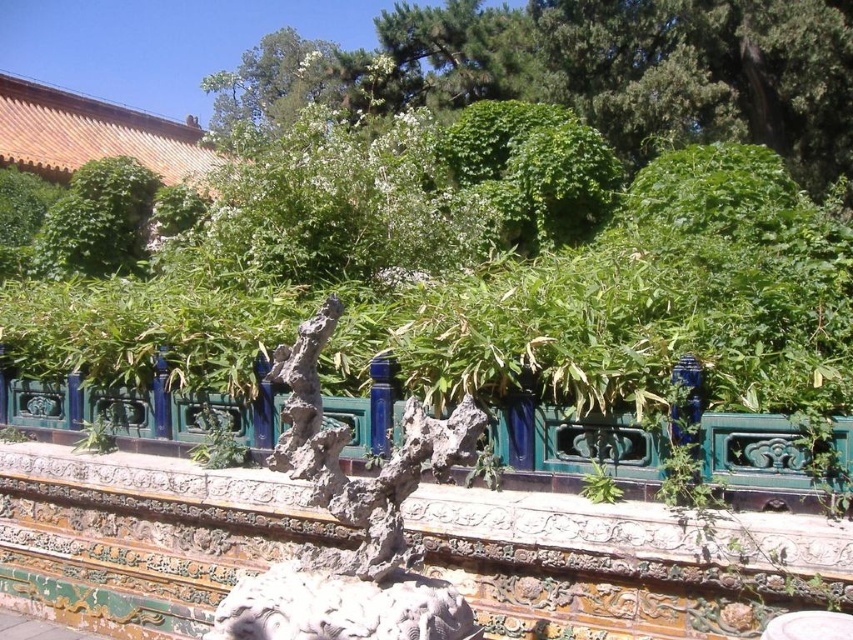
Image resolution: width=853 pixels, height=640 pixels. Identify the location of green leafy bush at upper center. (595, 72).

Which is behind, point (720, 132) or point (850, 429)?

Positioned behind is point (720, 132).

Image resolution: width=853 pixels, height=640 pixels. Find the location of `green leafy bush at upper center`. green leafy bush at upper center is located at coordinates (595, 72).

Is green leafy bush at upper left closer to camera compared to green leafy tree at upper center?

No, it is behind green leafy tree at upper center.

Based on the photo, does green leafy bush at upper left appear on the left side of green leafy tree at upper center?

Indeed, green leafy bush at upper left is positioned on the left side of green leafy tree at upper center.

I want to click on green leafy bush at upper left, so click(x=97, y=220).

Can you confirm if orange glazed tile roof at upper left is smaller than green leafy bush at upper left?

Actually, orange glazed tile roof at upper left might be larger than green leafy bush at upper left.

Image resolution: width=853 pixels, height=640 pixels. Identify the location of orange glazed tile roof at upper left. (91, 132).

This screenshot has height=640, width=853. I want to click on orange glazed tile roof at upper left, so click(91, 132).